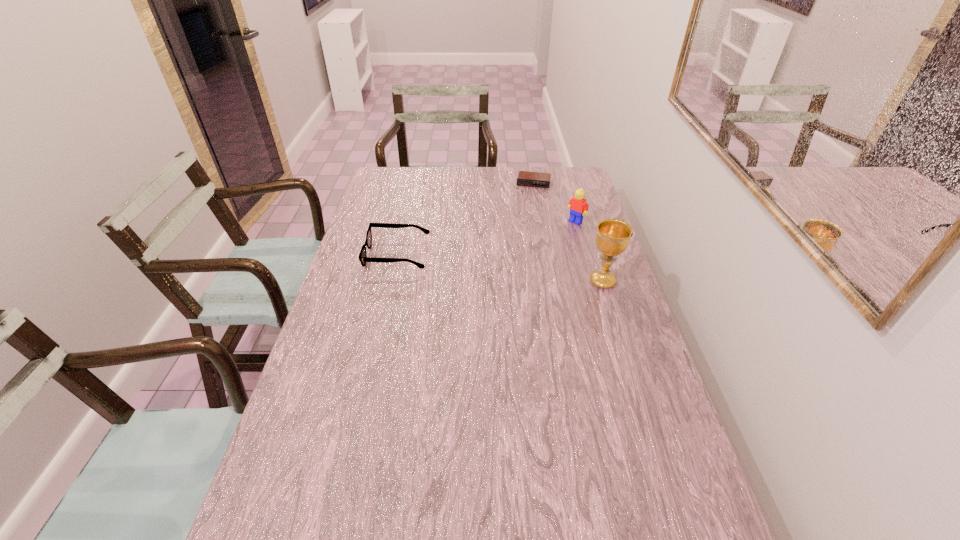
Locate an element on the screen. vacant space on the desktop that is between the spectacles and the chalice and is positioned on the front-facing side of the Lego is located at coordinates (517, 271).

Identify the location of vacant spot on the desktop that is between the leftmost object and the chalice and is positioned on the front face of the shortest object. The width and height of the screenshot is (960, 540). (517, 271).